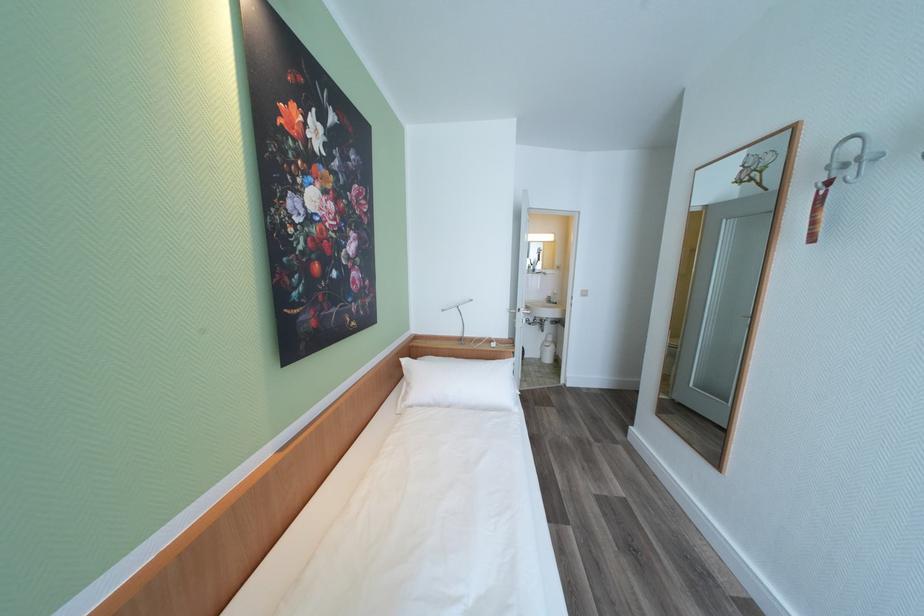
Find the location of a particular element. white pillow is located at coordinates (457, 383).